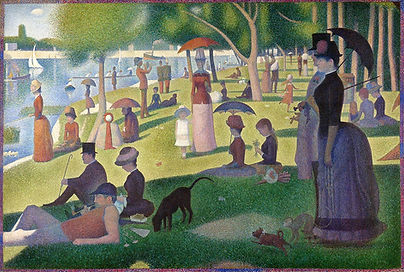
The height and width of the screenshot is (272, 404). Find the location of `shade`. shade is located at coordinates (148, 122), (380, 129).